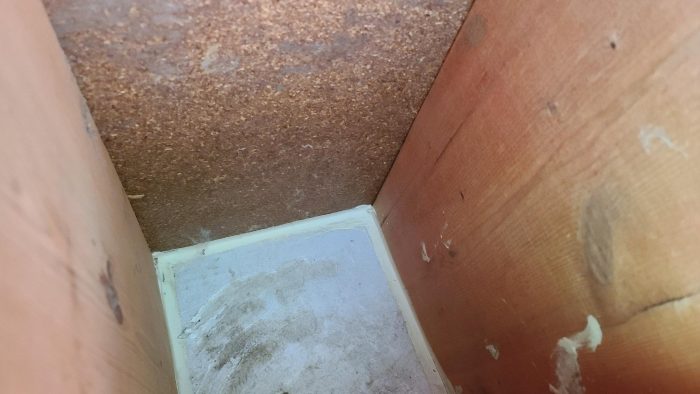
At what (x,y) coordinates should I click in order to perform the action: click on grainy wood board. Please return your answer as a coordinate pair (x, y). Looking at the image, I should click on (526, 174).